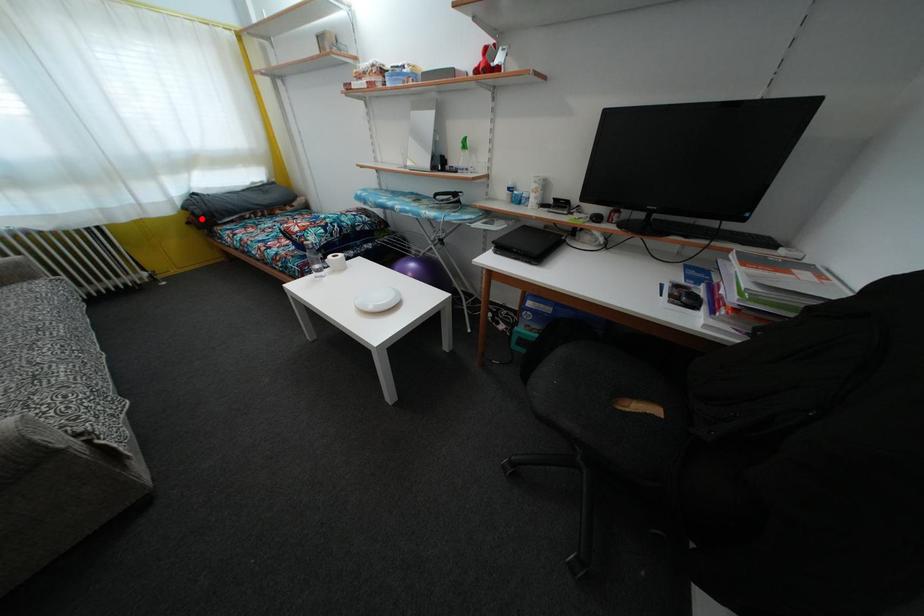
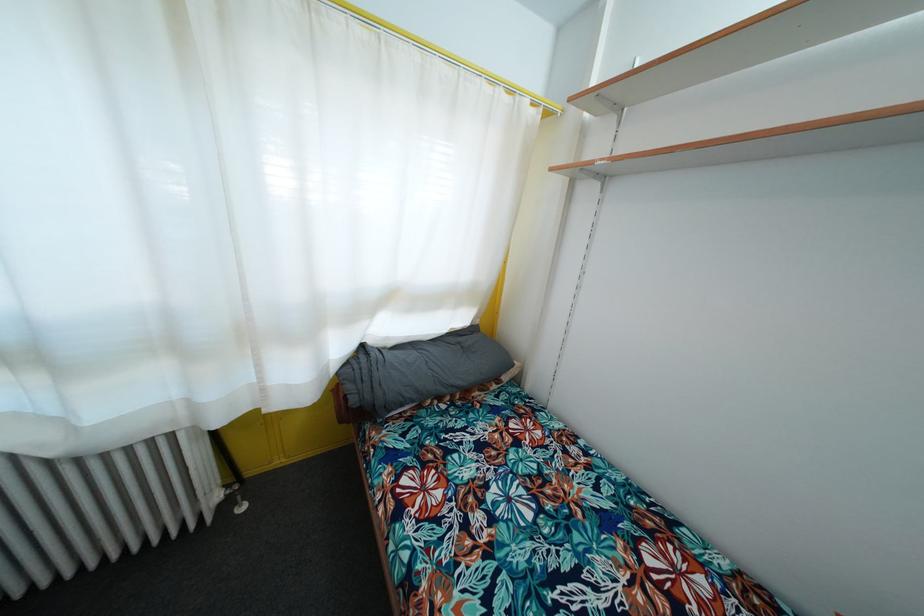
Question: I am providing you with two images of the same scene from different viewpoints. Given a red point in image1, look at the same physical point in image2. Is it:

Choices:
 (A) Closer to the viewpoint
 (B) Farther from the viewpoint

Answer: (B)